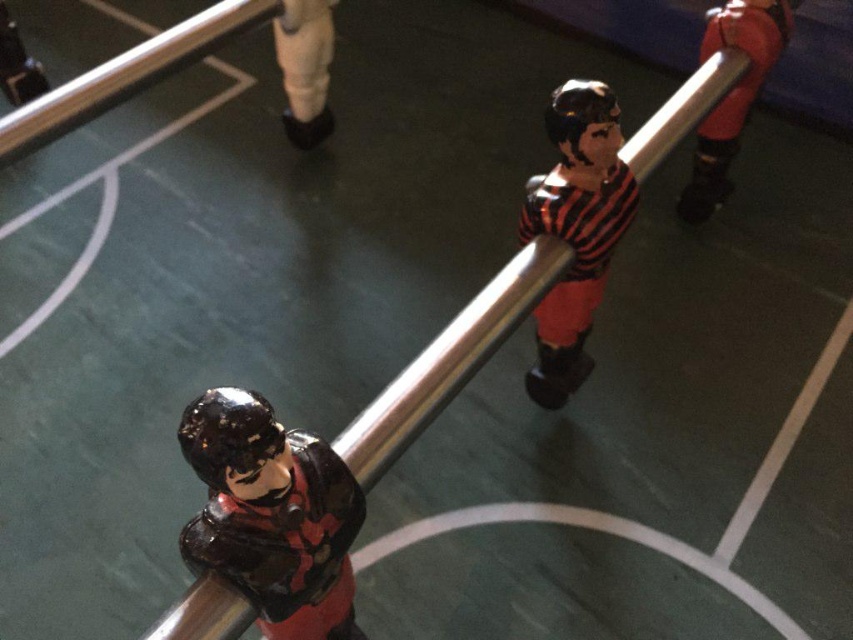
Between glossy plastic figure at center and black glossy figure at center, which one is positioned lower?

glossy plastic figure at center is below.

Does glossy plastic figure at center have a lesser width compared to black glossy figure at center?

No, glossy plastic figure at center is not thinner than black glossy figure at center.

Does point (265, 577) lie in front of point (595, 104)?

Yes, point (265, 577) is closer to viewer.

Find the location of `glossy plastic figure at center`. glossy plastic figure at center is located at coordinates (271, 515).

Describe the element at coordinates (448, 362) in the screenshot. This screenshot has width=853, height=640. I see `metallic silver pole at center` at that location.

Does metallic silver pole at center appear over black glossy figure at center?

No.

You are a GUI agent. You are given a task and a screenshot of the screen. Output one action in this format:
    pyautogui.click(x=<x>, y=<y>)
    Task: Click on the metallic silver pole at center
    The height and width of the screenshot is (640, 853).
    Given the screenshot: What is the action you would take?
    pyautogui.click(x=448, y=362)

Between glossy plastic figure at center and white matte leg at upper center, which one appears on the right side from the viewer's perspective?

Positioned to the right is glossy plastic figure at center.

Looking at this image, who is higher up, glossy plastic figure at center or white matte leg at upper center?

white matte leg at upper center is above.

At what (x,y) coordinates should I click in order to perform the action: click on glossy plastic figure at center. Please return your answer as a coordinate pair (x, y). Looking at the image, I should click on (271, 515).